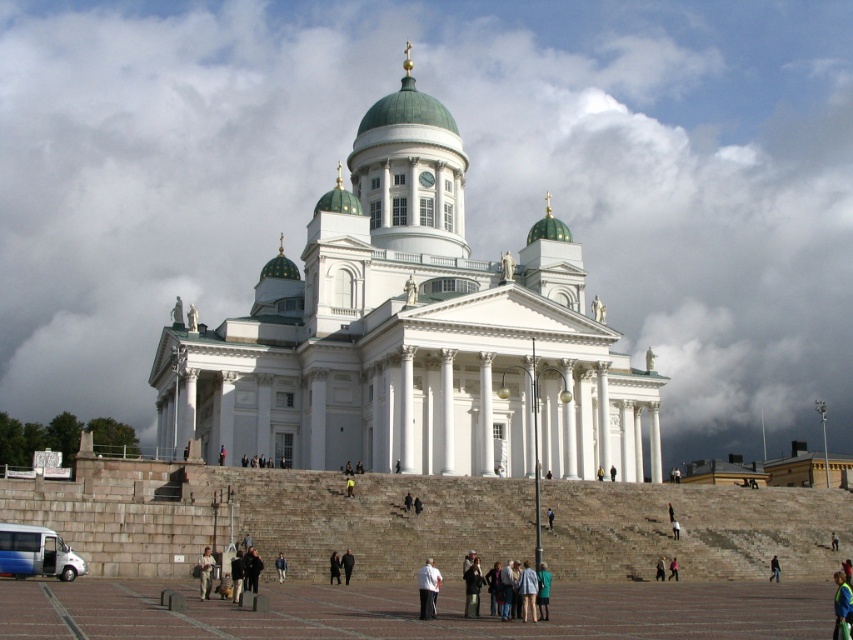
Does light brown leather jacket at lower center appear over dark blue jeans at center?

Indeed, light brown leather jacket at lower center is positioned over dark blue jeans at center.

Can you confirm if light brown leather jacket at lower center is smaller than dark blue jeans at center?

Incorrect, light brown leather jacket at lower center is not smaller in size than dark blue jeans at center.

Which is behind, point (200, 560) or point (776, 563)?

Point (776, 563)

Locate an element on the screen. light brown leather jacket at lower center is located at coordinates (206, 572).

Is point (310, 234) in front of point (253, 564)?

No, it is behind (253, 564).

Identify the location of white marble church at center. (408, 336).

The height and width of the screenshot is (640, 853). In order to click on white marble church at center in this screenshot , I will do `click(408, 336)`.

Can you confirm if dark brown leather jacket at center is shorter than dark blue jeans at lower center?

Yes.

Who is shorter, dark brown leather jacket at center or dark blue jeans at lower center?

dark brown leather jacket at center

Where is `dark brown leather jacket at center`? dark brown leather jacket at center is located at coordinates (236, 573).

Where is `dark brown leather jacket at center`? This screenshot has width=853, height=640. dark brown leather jacket at center is located at coordinates (236, 573).